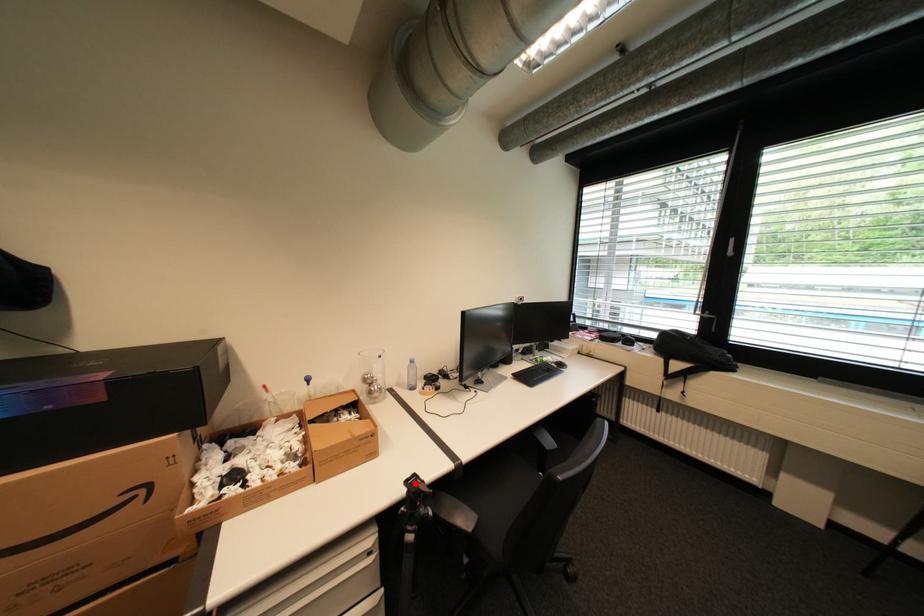
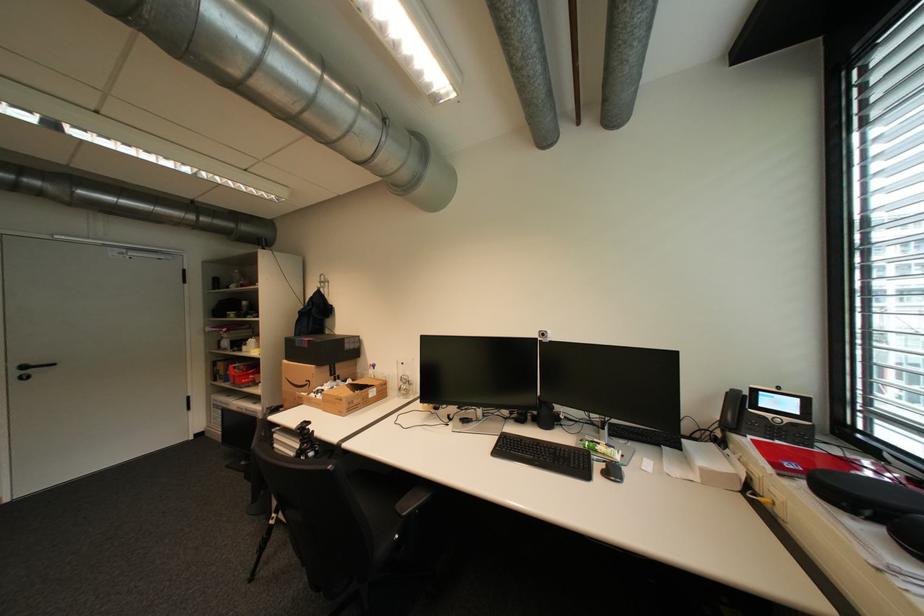
Question: I am providing you with two images of the same scene from different viewpoints. A red point is marked on the first image. Can you still see the location of the red point in image 2?

Choices:
 (A) Yes
 (B) No

Answer: (B)